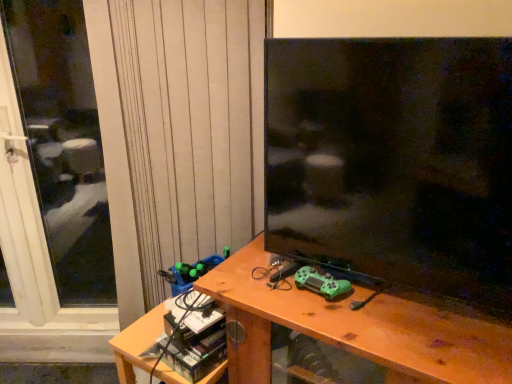
The width and height of the screenshot is (512, 384). Find the location of `spots to the right of green matte game controller at center, which appears as the 1th toy when viewed from the front`. spots to the right of green matte game controller at center, which appears as the 1th toy when viewed from the front is located at coordinates (382, 305).